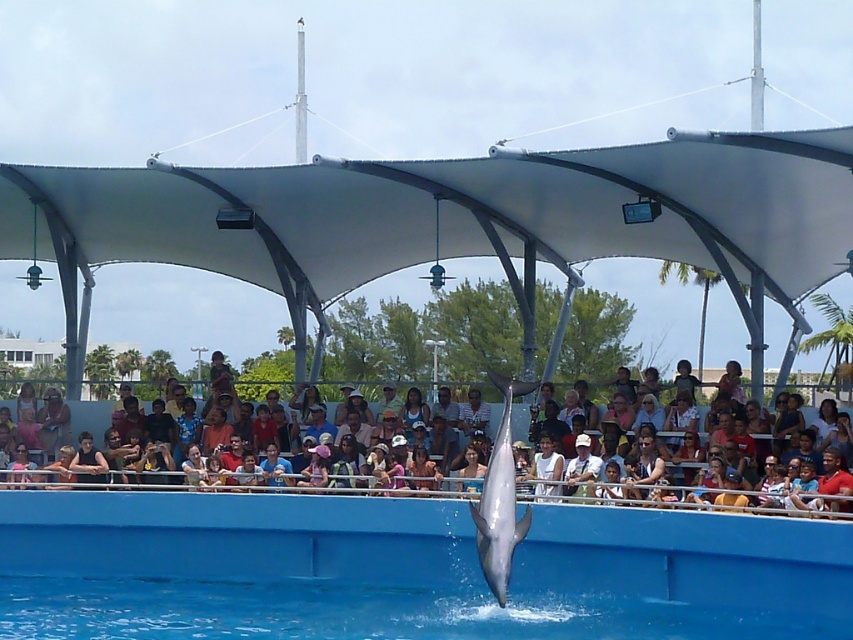
You are a marine biologist observing the dolphin show. You need to determine the exact location of the blue smooth water in the image. What are the coordinates of the blue smooth water at center?

The blue smooth water at center is located at point coordinates (405, 570).